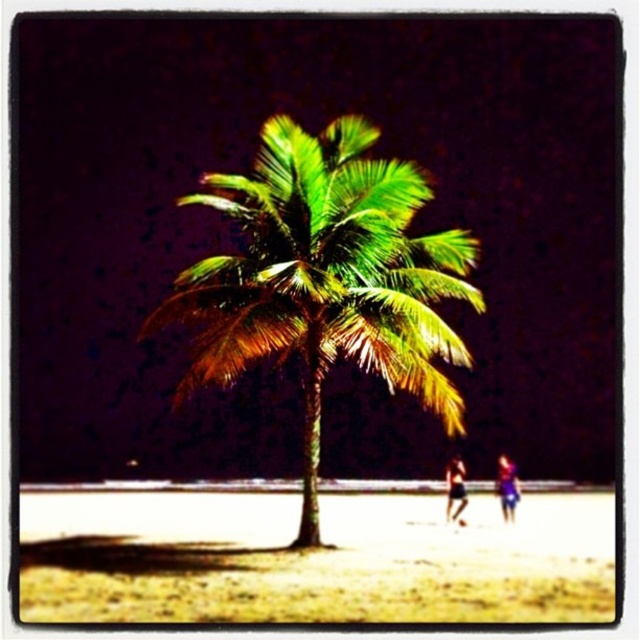
Question: Which is nearer to the dark blue fabric shorts at lower right?

Choices:
 (A) blue fabric at lower right
 (B) green leafy palm at center
 (C) beige sandy beach at center

Answer: (A)

Question: Is blue fabric at lower right bigger than dark blue fabric shorts at lower right?

Choices:
 (A) no
 (B) yes

Answer: (B)

Question: Is beige sandy beach at center behind green leafy palm at center?

Choices:
 (A) yes
 (B) no

Answer: (A)

Question: Which is nearer to the blue fabric at lower right?

Choices:
 (A) beige sandy beach at center
 (B) dark blue fabric shorts at lower right

Answer: (B)

Question: Which object appears closest to the camera in this image?

Choices:
 (A) blue fabric at lower right
 (B) beige sandy beach at center

Answer: (B)

Question: Can you confirm if beige sandy beach at center is positioned to the left of green leafy palm at center?

Choices:
 (A) no
 (B) yes

Answer: (B)